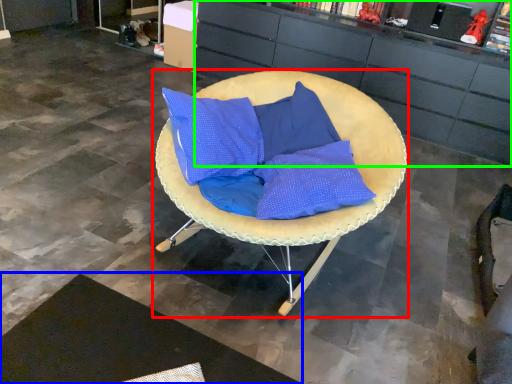
Question: Which is nearer to the chair (highlighted by a red box)? mat (highlighted by a blue box) or cabinetry (highlighted by a green box).

Choices:
 (A) mat
 (B) cabinetry

Answer: (A)